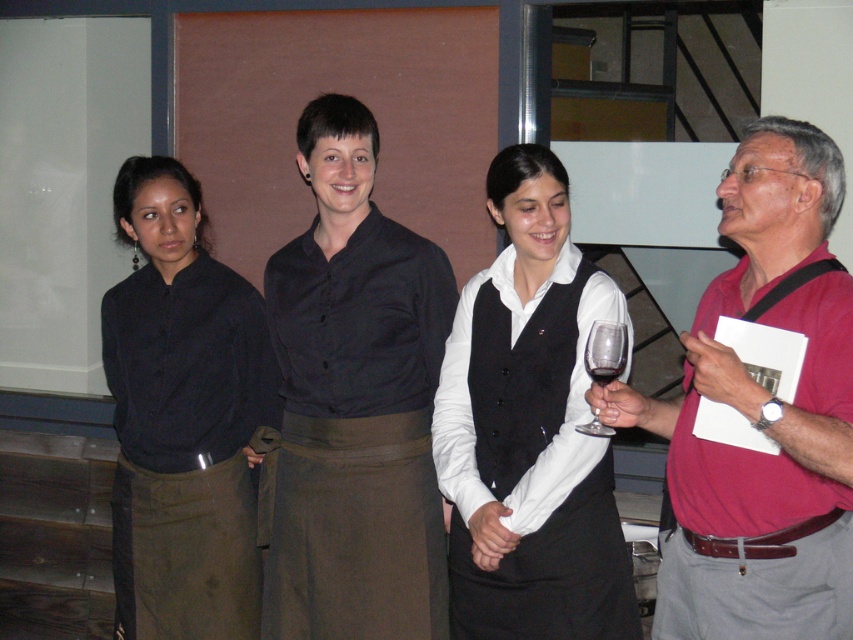
From the picture: You are organizing a clothing donation drive and need to categorize shirts based on their material thickness. You have two shirts in front of you, the black satin shirt at center and the black matte shirt at left. Which shirt should you place in the category for thinner materials?

The black satin shirt at center is thinner than the black matte shirt at left, so it should be placed in the category for thinner materials.

You are organizing a clothing display and need to arrange the black satin shirt at center and the black matte shirt at left in a limited space. Which shirt should you choose to fit better in a smaller display area?

The black satin shirt at center occupies less space than the black matte shirt at left, so it would fit better in a smaller display area.